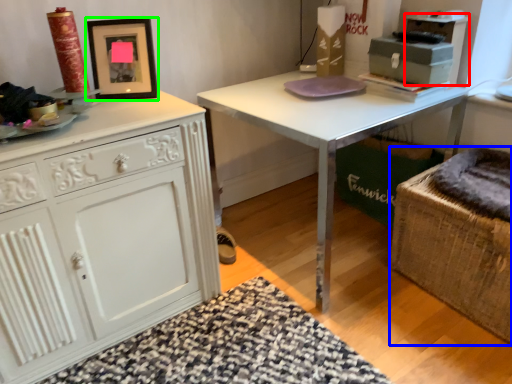
Question: Estimate the real-world distances between objects in this image. Which object is closer to cabinetry (highlighted by a red box), swivel chair (highlighted by a blue box) or picture frame (highlighted by a green box)?

Choices:
 (A) swivel chair
 (B) picture frame

Answer: (A)